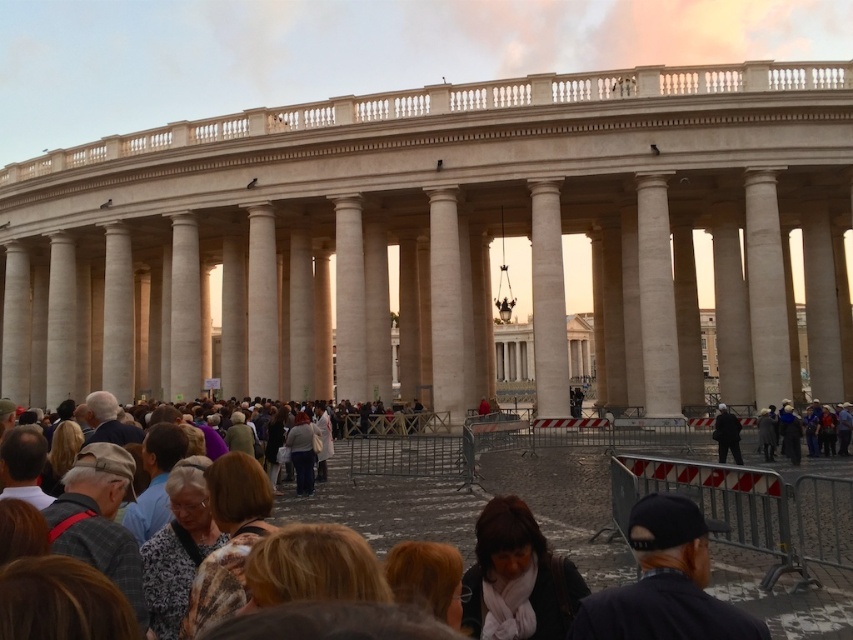
What are the coordinates of `white scarf at center` in the screenshot? It's located at click(x=518, y=577).

Is white scarf at center to the left of fluffy brown coat at center from the viewer's perspective?

No, white scarf at center is not to the left of fluffy brown coat at center.

Is point (515, 612) less distant than point (239, 512)?

Yes, point (515, 612) is closer to viewer.

Where is `white scarf at center`? This screenshot has width=853, height=640. white scarf at center is located at coordinates (518, 577).

Is metallic silver barrier at lower right taller than blonde hair at lower center?

Yes.

Who is more distant from viewer, (718, 532) or (410, 568)?

The point (718, 532) is more distant.

This screenshot has width=853, height=640. I want to click on metallic silver barrier at lower right, so click(749, 508).

Does fluffy brown coat at center appear over patterned fabric headscarf at center?

Yes, fluffy brown coat at center is above patterned fabric headscarf at center.

Who is higher up, fluffy brown coat at center or patterned fabric headscarf at center?

Positioned higher is fluffy brown coat at center.

Where is `fluffy brown coat at center`? This screenshot has height=640, width=853. fluffy brown coat at center is located at coordinates (228, 540).

Identify the location of fluffy brown coat at center. (228, 540).